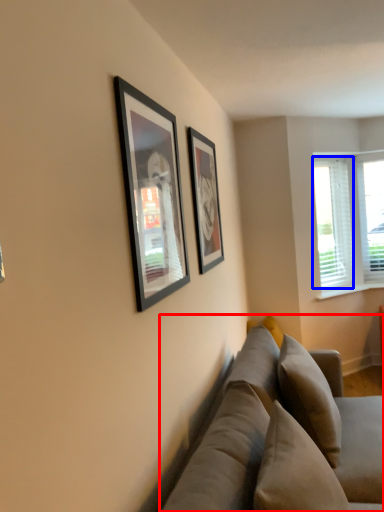
Question: Which object is further to the camera taking this photo, studio couch (highlighted by a red box) or window screen (highlighted by a blue box)?

Choices:
 (A) studio couch
 (B) window screen

Answer: (B)